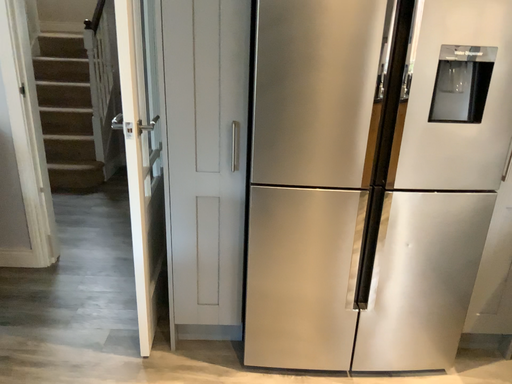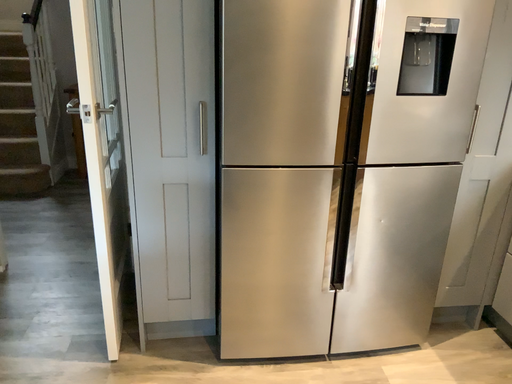
Question: Which way did the camera rotate in the video?

Choices:
 (A) rotated right
 (B) rotated left

Answer: (A)